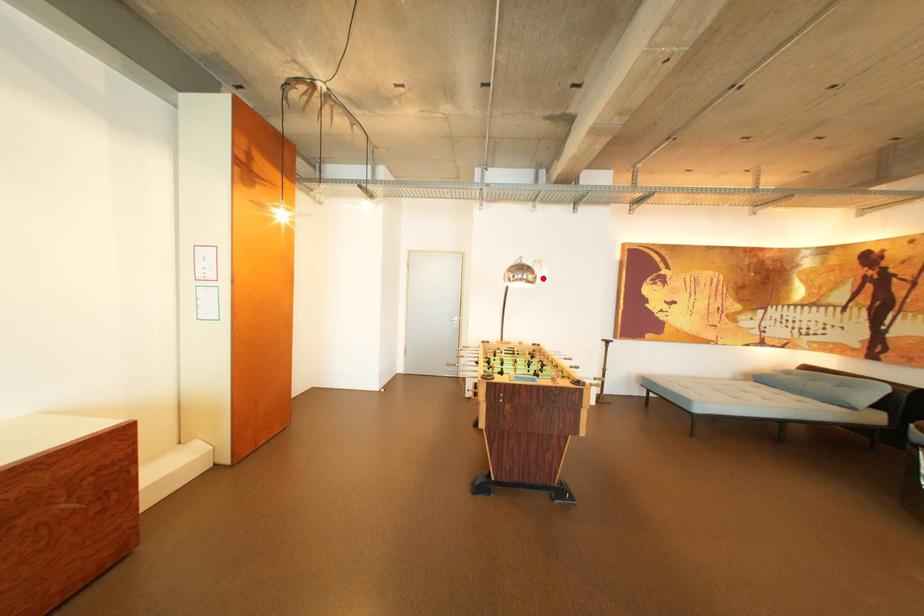
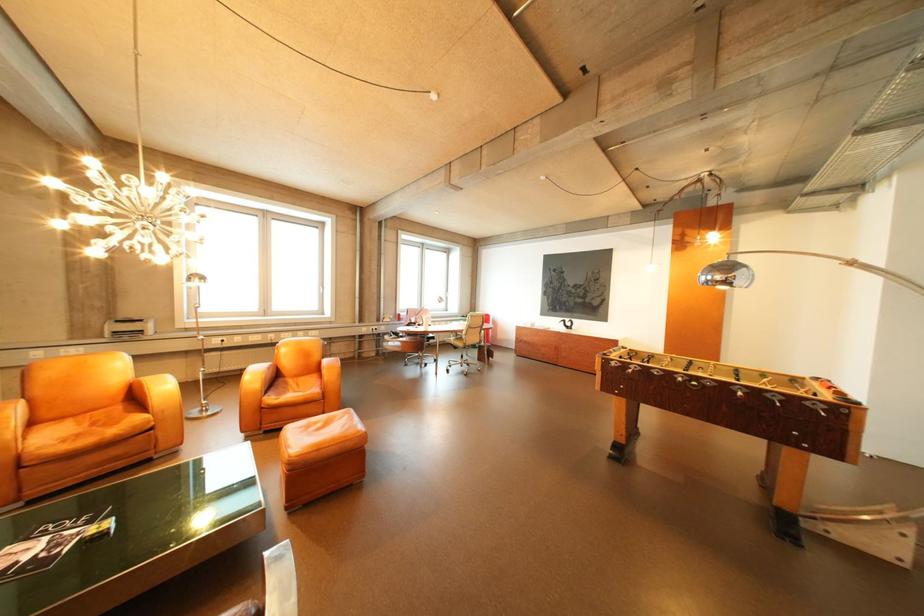
Locate, in the second image, the point that corresponds to the highlighted location in the first image.

(732, 278)